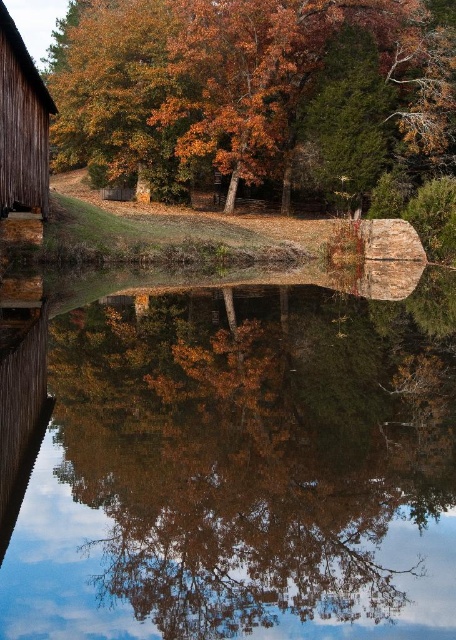
Is orange autumn leaves at upper center shorter than wooden barn at left?

In fact, orange autumn leaves at upper center may be taller than wooden barn at left.

Does orange autumn leaves at upper center appear on the left side of wooden barn at left?

In fact, orange autumn leaves at upper center is to the right of wooden barn at left.

The width and height of the screenshot is (456, 640). In order to click on orange autumn leaves at upper center in this screenshot , I will do `click(254, 86)`.

From the picture: Between smooth reflective water at center and wooden barn at left, which one is positioned higher?

Positioned higher is wooden barn at left.

Between point (234, 561) and point (24, 154), which one is positioned in front?

Point (234, 561)

Find the location of a particular element. Image resolution: width=456 pixels, height=640 pixels. smooth reflective water at center is located at coordinates (243, 467).

Between smooth reflective water at center and orange autumn leaves at upper center, which one appears on the right side from the viewer's perspective?

From the viewer's perspective, smooth reflective water at center appears more on the right side.

Does point (248, 342) come behind point (109, 172)?

No, it is in front of (109, 172).

Image resolution: width=456 pixels, height=640 pixels. What do you see at coordinates (243, 467) in the screenshot?
I see `smooth reflective water at center` at bounding box center [243, 467].

What are the coordinates of `smooth reflective water at center` in the screenshot? It's located at (243, 467).